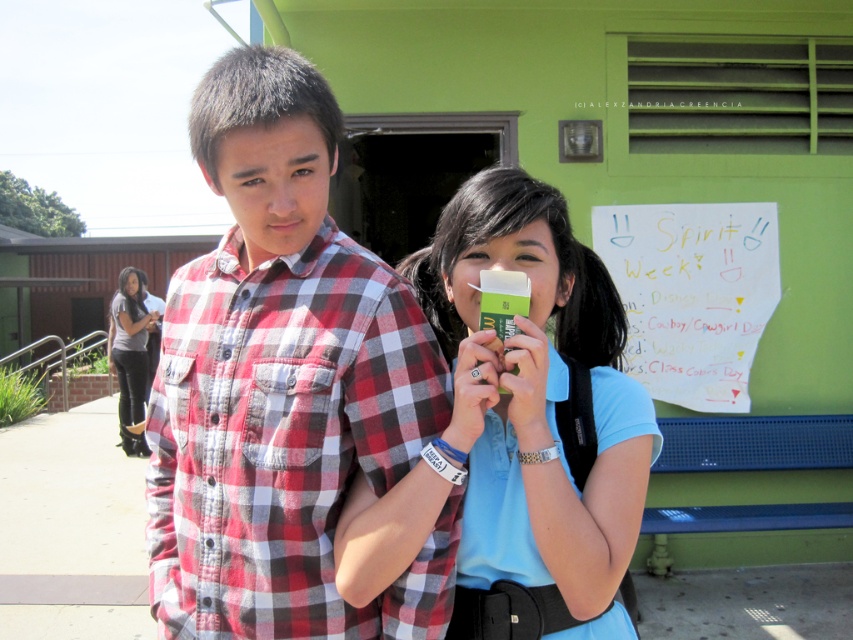
You are a photographer trying to capture a clear shot of the white paper at upper right and the dark gray jeans at lower left. Which object should you focus on first if you want to ensure both are in focus without adjusting the camera settings?

The white paper at upper right is shorter than dark gray jeans at lower left. Since the dark gray jeans at lower left is taller, focusing on it first would help ensure both are in focus as the shorter object might be within the depth of field range when focusing on the taller one.

You are taking a photo of two people standing in front of a Spirit Week sign. The first person is at point (285, 467) and the second is at point (624, 244). Which point is closer to the camera?

Point (285, 467) is closer to the camera than point (624, 244).

You are planning to place a small sticker on the image such that it is between the white paper at upper right and the dark gray jeans at lower left. Based on their positions, where should you position the sticker?

The white paper at upper right is above the dark gray jeans at lower left, so you should place the sticker somewhere between their vertical positions, below the white paper at upper right and above the dark gray jeans at lower left.